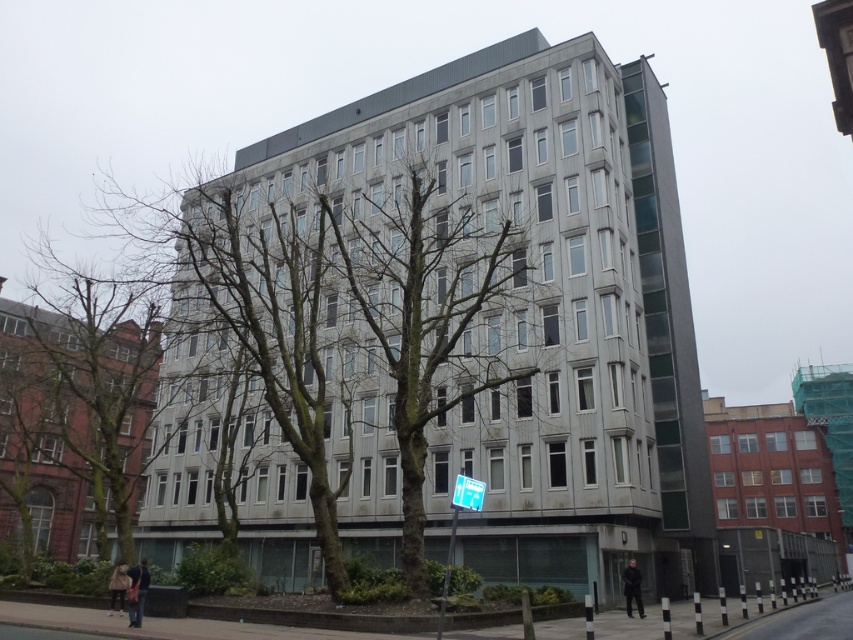
You are standing at the entrance of the building and want to plant a new tree exactly at the center of the building. Based on the image, is the bare wood tree at center already located at the desired position?

The bare wood tree at center is already located at the center of the building, as its coordinates are exactly at point [428,312], which is very close to the center point.

You are a city planner who needs to install a new 50 feet wide bench between the bare wood tree at center and the white plastic street sign at center. Is there enough space to place it without moving either object?

The distance between the bare wood tree at center and the white plastic street sign at center is 49.75 feet, which is slightly less than the required 50 feet. Therefore, there isn not enough space to place the bench without moving either object.